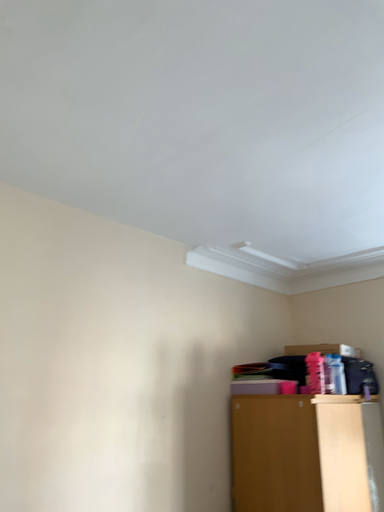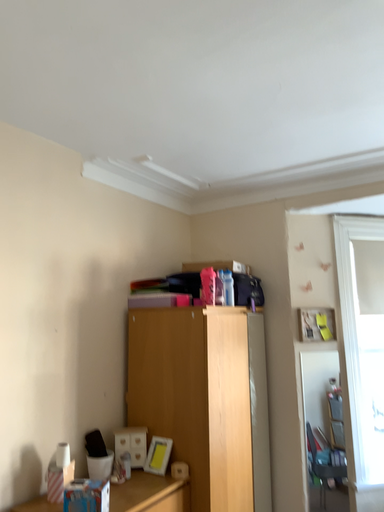
Question: How did the camera likely rotate when shooting the video?

Choices:
 (A) rotated right
 (B) rotated left

Answer: (A)